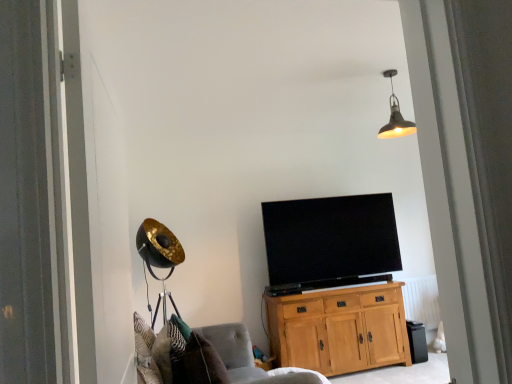
Question: From a real-world perspective, is metallic pendant light at upper center beneath light oak cabinet at center?

Choices:
 (A) no
 (B) yes

Answer: (A)

Question: Could you tell me if metallic pendant light at upper center is turned towards light oak cabinet at center?

Choices:
 (A) no
 (B) yes

Answer: (A)

Question: Does metallic pendant light at upper center contain light oak cabinet at center?

Choices:
 (A) no
 (B) yes

Answer: (A)

Question: Is metallic pendant light at upper center located outside light oak cabinet at center?

Choices:
 (A) no
 (B) yes

Answer: (B)

Question: Considering the relative positions of metallic pendant light at upper center and light oak cabinet at center in the image provided, is metallic pendant light at upper center behind light oak cabinet at center?

Choices:
 (A) yes
 (B) no

Answer: (B)

Question: Considering the relative sizes of metallic pendant light at upper center and light oak cabinet at center in the image provided, is metallic pendant light at upper center taller than light oak cabinet at center?

Choices:
 (A) yes
 (B) no

Answer: (B)

Question: Is black plastic trash bin at lower right facing away from soft gray fabric chair at lower left?

Choices:
 (A) no
 (B) yes

Answer: (A)

Question: Considering the relative sizes of black plastic trash bin at lower right and soft gray fabric chair at lower left in the image provided, is black plastic trash bin at lower right bigger than soft gray fabric chair at lower left?

Choices:
 (A) yes
 (B) no

Answer: (B)

Question: Could you tell me if black plastic trash bin at lower right is facing soft gray fabric chair at lower left?

Choices:
 (A) no
 (B) yes

Answer: (A)

Question: Considering the relative positions of black plastic trash bin at lower right and soft gray fabric chair at lower left in the image provided, is black plastic trash bin at lower right to the right of soft gray fabric chair at lower left from the viewer's perspective?

Choices:
 (A) yes
 (B) no

Answer: (A)

Question: Can you confirm if black plastic trash bin at lower right is shorter than soft gray fabric chair at lower left?

Choices:
 (A) no
 (B) yes

Answer: (B)

Question: Is black plastic trash bin at lower right thinner than soft gray fabric chair at lower left?

Choices:
 (A) no
 (B) yes

Answer: (B)

Question: From a real-world perspective, is light oak cabinet at center on top of black plastic trash bin at lower right?

Choices:
 (A) yes
 (B) no

Answer: (A)